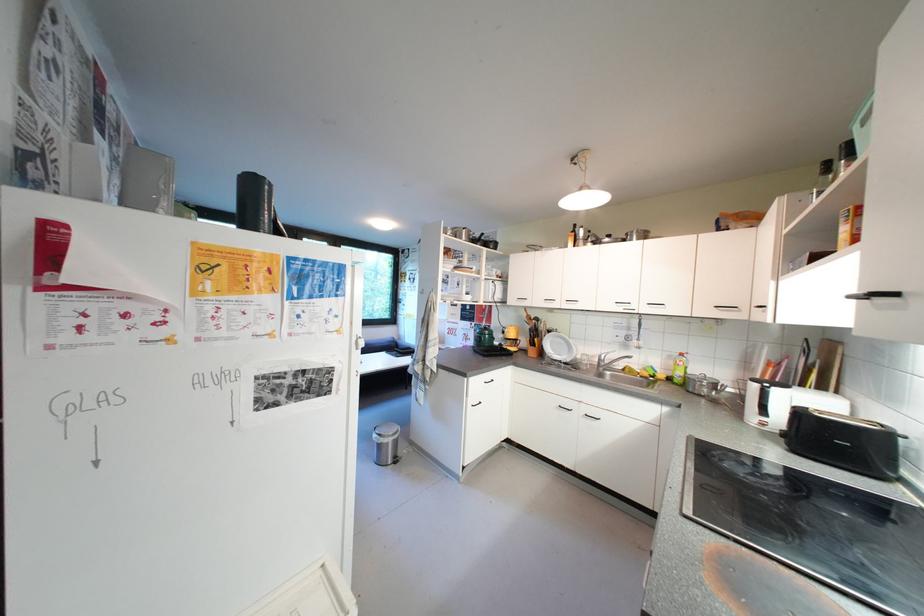
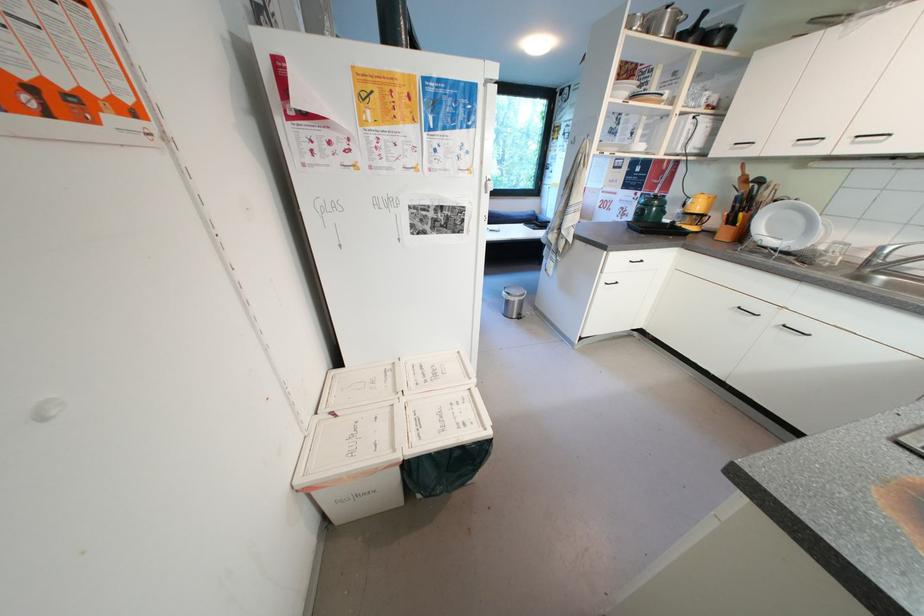
Where in the second image is the point corresponding to point 480,402 from the first image?

(614, 280)